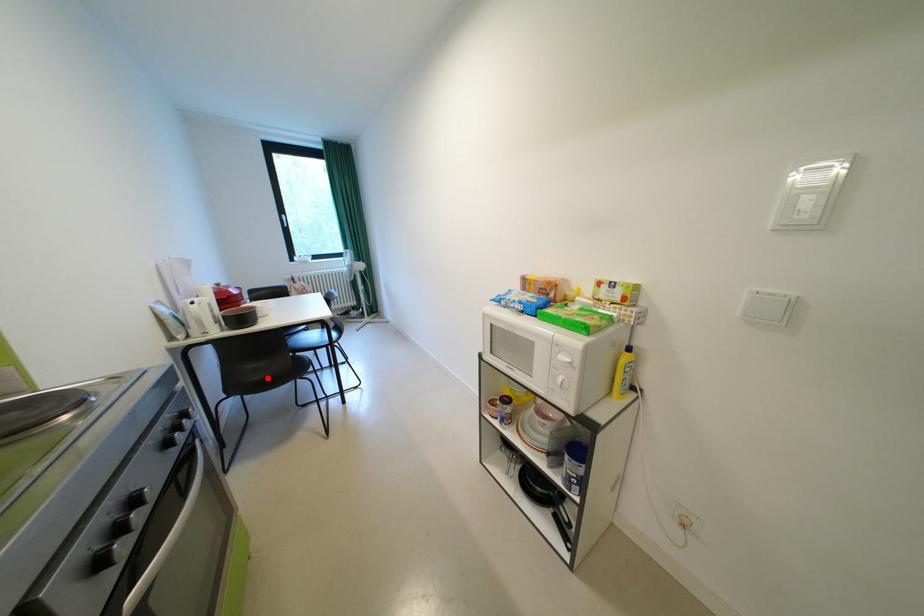
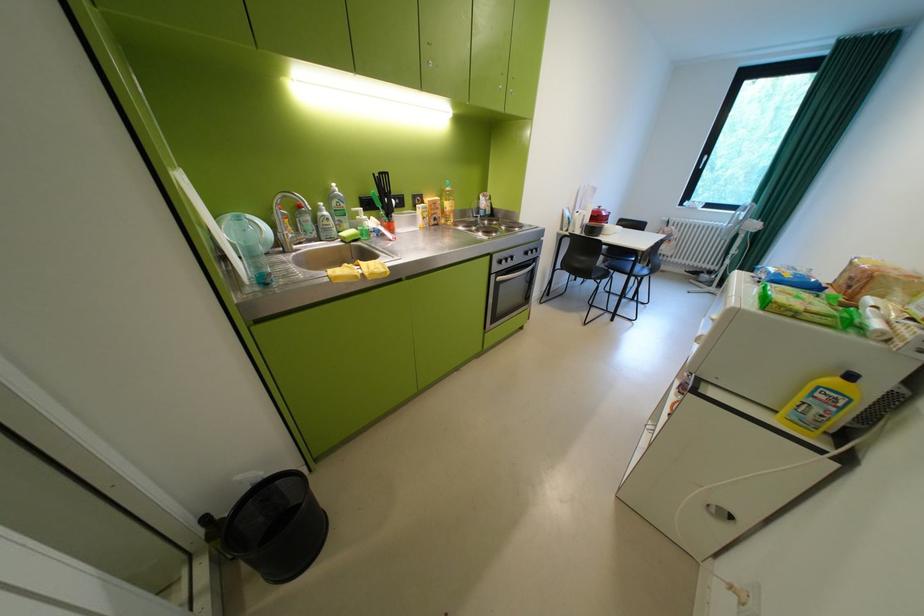
Question: I am providing you with two images of the same scene from different viewpoints. Given a red point in image1, look at the same physical point in image2. Is it:

Choices:
 (A) Closer to the viewpoint
 (B) Farther from the viewpoint

Answer: (A)